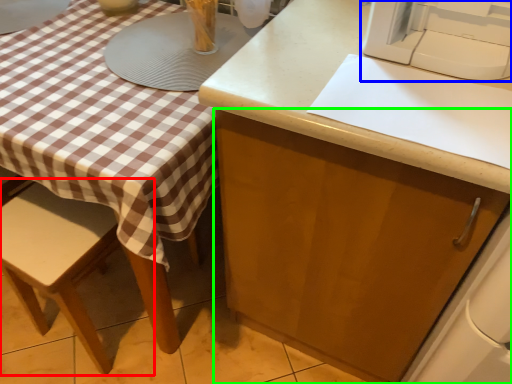
Question: Which object is the farthest from chair (highlighted by a red box)? Choose among these: sewing machine (highlighted by a blue box) or cabinetry (highlighted by a green box).

Choices:
 (A) sewing machine
 (B) cabinetry

Answer: (A)